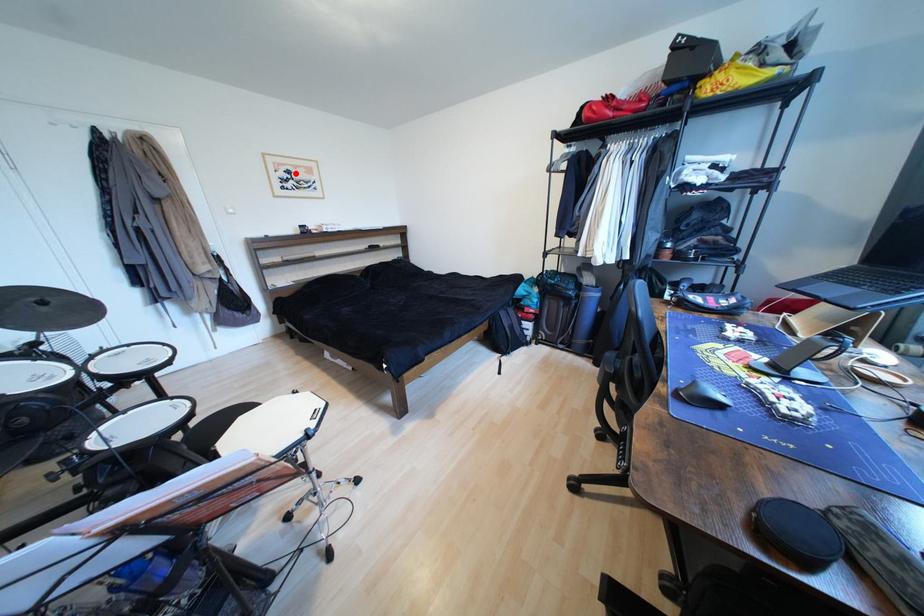
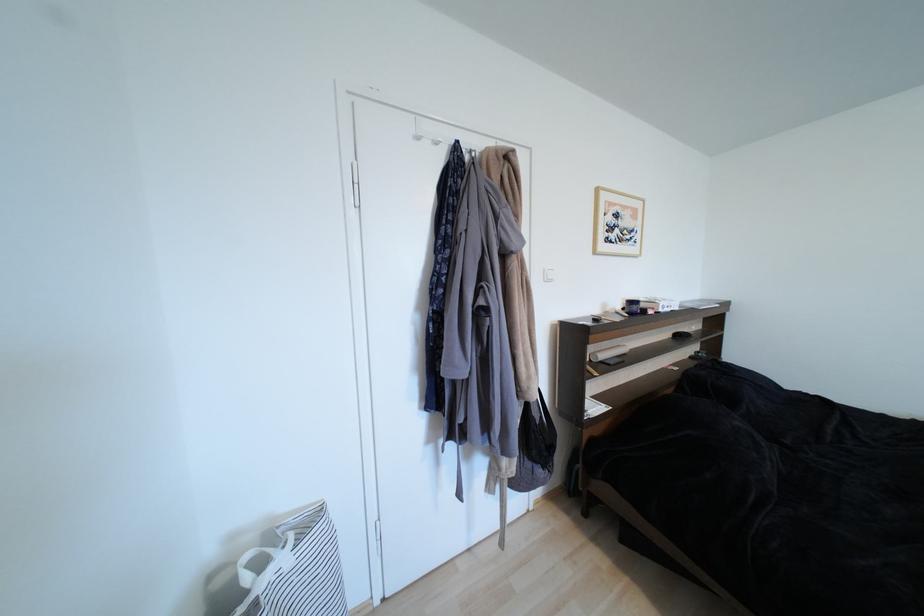
The point at the highlighted location is marked in the first image. Where is the corresponding point in the second image?

(623, 217)